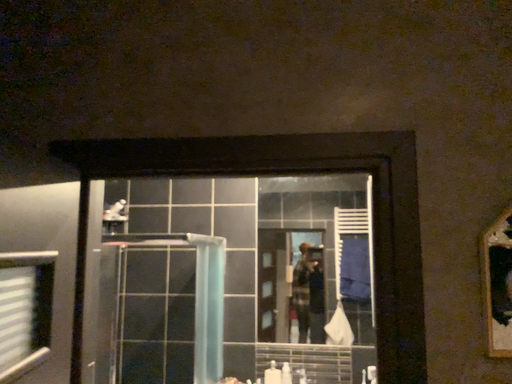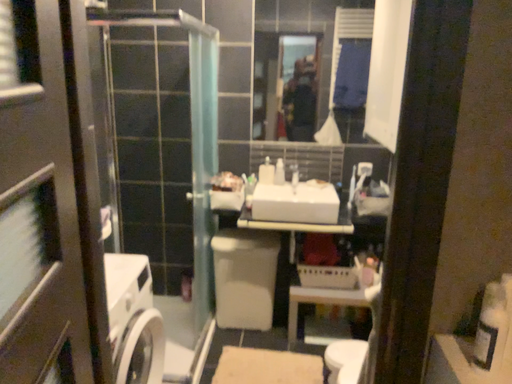
Question: Which way did the camera rotate in the video?

Choices:
 (A) rotated downward
 (B) rotated upward

Answer: (A)